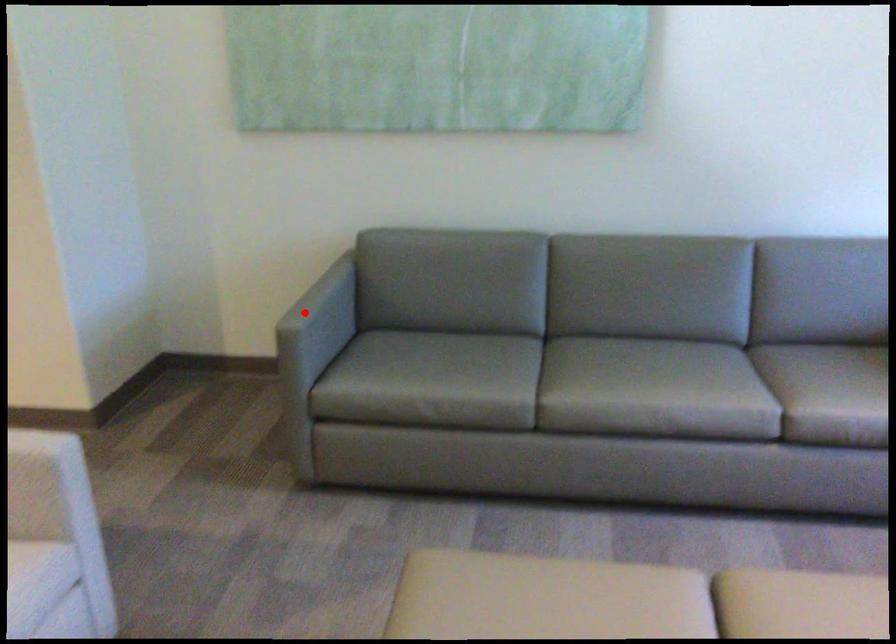
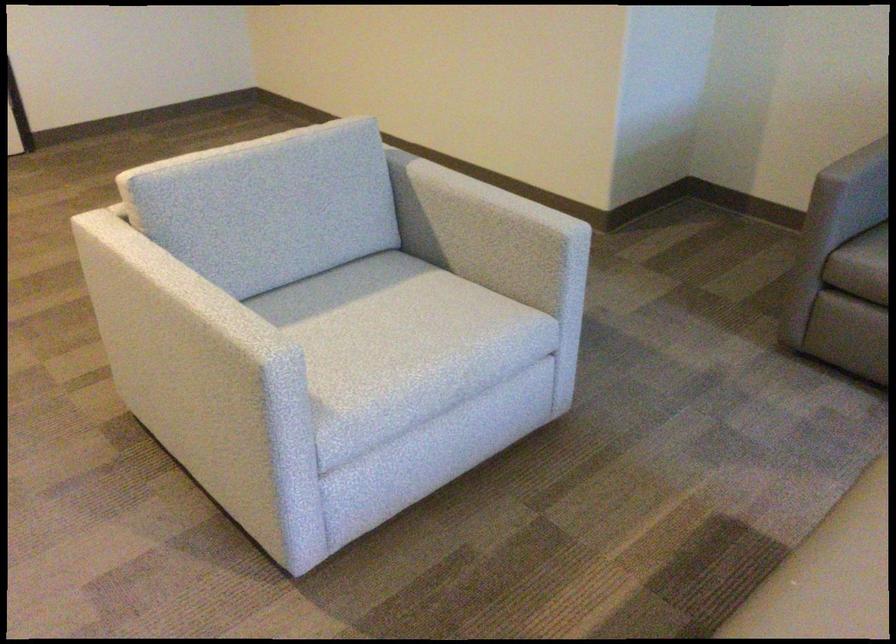
Find the pixel in the second image that matches the highlighted location in the first image.

(858, 164)